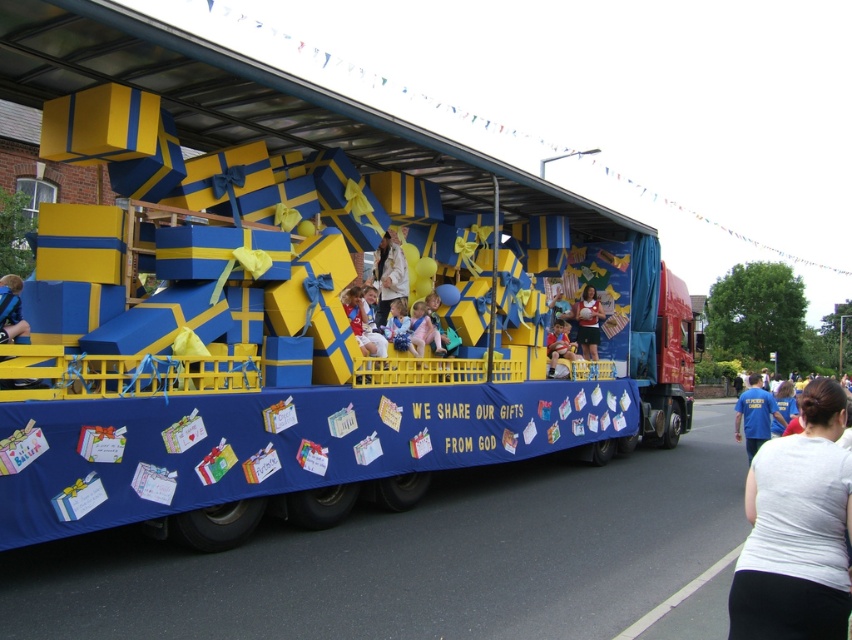
Question: Can you confirm if light beige fabric at center is positioned to the left of light blue fabric at center?

Choices:
 (A) no
 (B) yes

Answer: (B)

Question: Among these points, which one is farthest from the camera?

Choices:
 (A) (738, 438)
 (B) (349, 296)

Answer: (A)

Question: Among these objects, which one is farthest from the camera?

Choices:
 (A) light blue fabric at center
 (B) blue t-shirt at right
 (C) light beige fabric at center

Answer: (A)

Question: Where is blue t-shirt at right located in relation to matte white dress at center in the image?

Choices:
 (A) right
 (B) left

Answer: (A)

Question: Can you confirm if light beige fabric at center is positioned below matte blue dress at center?

Choices:
 (A) yes
 (B) no

Answer: (B)

Question: Estimate the real-world distances between objects in this image. Which object is farther from the matte blue dress at center?

Choices:
 (A) white cotton shirt at lower right
 (B) light beige fabric at center
 (C) light blue fabric at center

Answer: (A)